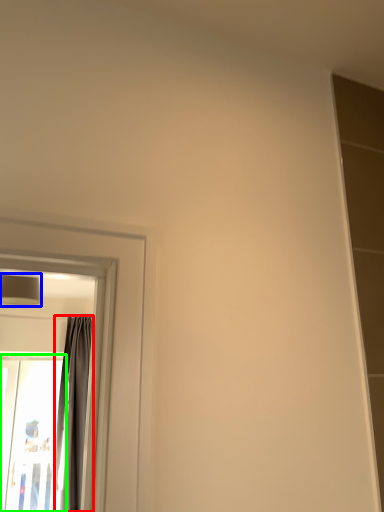
Question: Estimate the real-world distances between objects in this image. Which object is closer to curtain (highlighted by a red box), lamp (highlighted by a blue box) or screen door (highlighted by a green box)?

Choices:
 (A) lamp
 (B) screen door

Answer: (B)